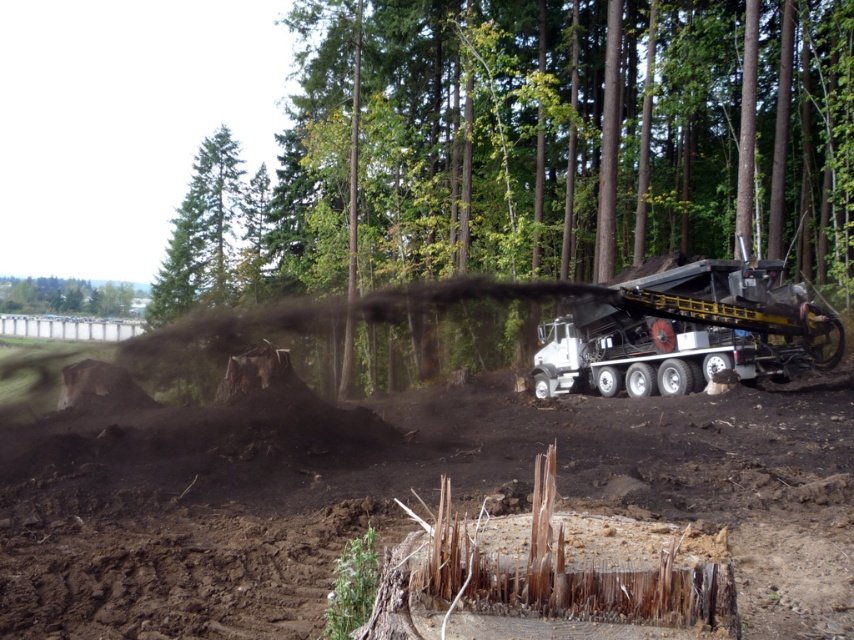
Can you confirm if smooth bark tree stump at center is positioned above metallic gray truck at right?

Indeed, smooth bark tree stump at center is positioned over metallic gray truck at right.

Between smooth bark tree stump at center and metallic gray truck at right, which one is positioned higher?

Positioned higher is smooth bark tree stump at center.

I want to click on smooth bark tree stump at center, so click(535, 147).

Is point (718, 81) behind point (832, 456)?

Yes, it is.

Does point (483, 164) lie in front of point (311, 566)?

No, it is behind (311, 566).

This screenshot has height=640, width=854. In order to click on smooth bark tree stump at center in this screenshot , I will do `click(535, 147)`.

Where is `smooth bark tree stump at center`? The height and width of the screenshot is (640, 854). smooth bark tree stump at center is located at coordinates (535, 147).

Which is below, metallic gray truck at right or green leafy tree at upper left?

Positioned lower is metallic gray truck at right.

Is metallic gray truck at right taller than green leafy tree at upper left?

Incorrect, metallic gray truck at right's height is not larger of green leafy tree at upper left's.

The image size is (854, 640). Describe the element at coordinates (686, 332) in the screenshot. I see `metallic gray truck at right` at that location.

Where is `metallic gray truck at right`? Image resolution: width=854 pixels, height=640 pixels. metallic gray truck at right is located at coordinates (686, 332).